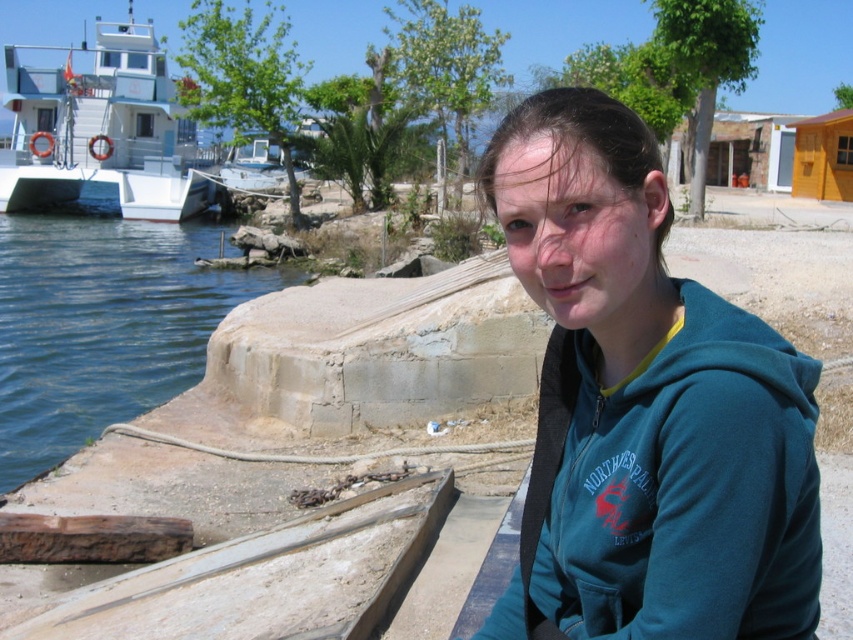
Question: Estimate the real-world distances between objects in this image. Which object is farther from the teal fleece jacket at center?

Choices:
 (A) blue water at lower left
 (B) white glossy boat at upper left

Answer: (B)

Question: Which of the following is the closest to the observer?

Choices:
 (A) [36, 84]
 (B) [86, 328]
 (C) [775, 376]

Answer: (C)

Question: Can you confirm if teal fleece jacket at center is smaller than blue water at lower left?

Choices:
 (A) no
 (B) yes

Answer: (B)

Question: Which point appears farthest from the camera in this image?

Choices:
 (A) (42, 332)
 (B) (753, 600)

Answer: (A)

Question: Does blue water at lower left lie behind white glossy boat at upper left?

Choices:
 (A) no
 (B) yes

Answer: (A)

Question: Can you confirm if teal fleece jacket at center is positioned to the left of blue water at lower left?

Choices:
 (A) yes
 (B) no

Answer: (B)